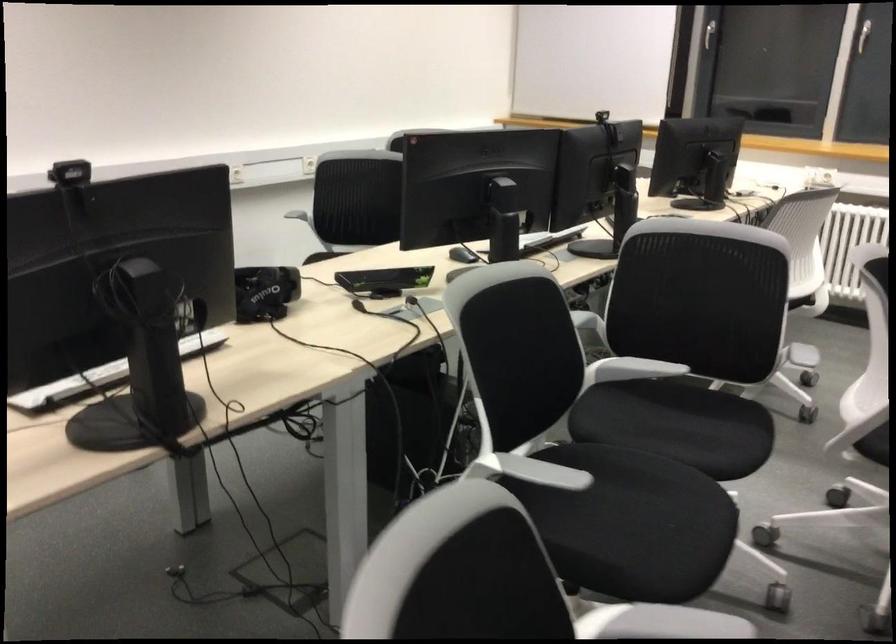
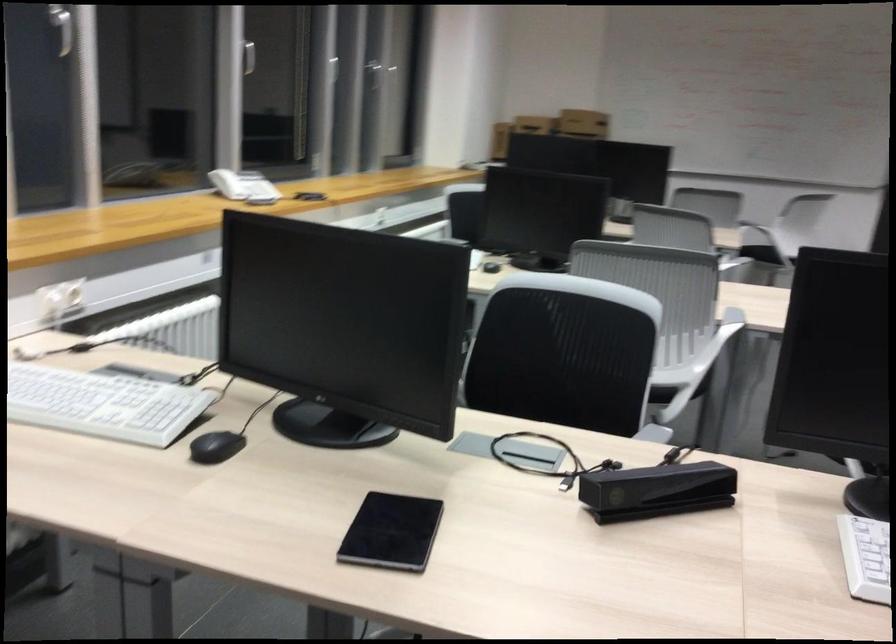
Where in the second image is the point corresponding to (789,216) from the first image?

(564, 353)